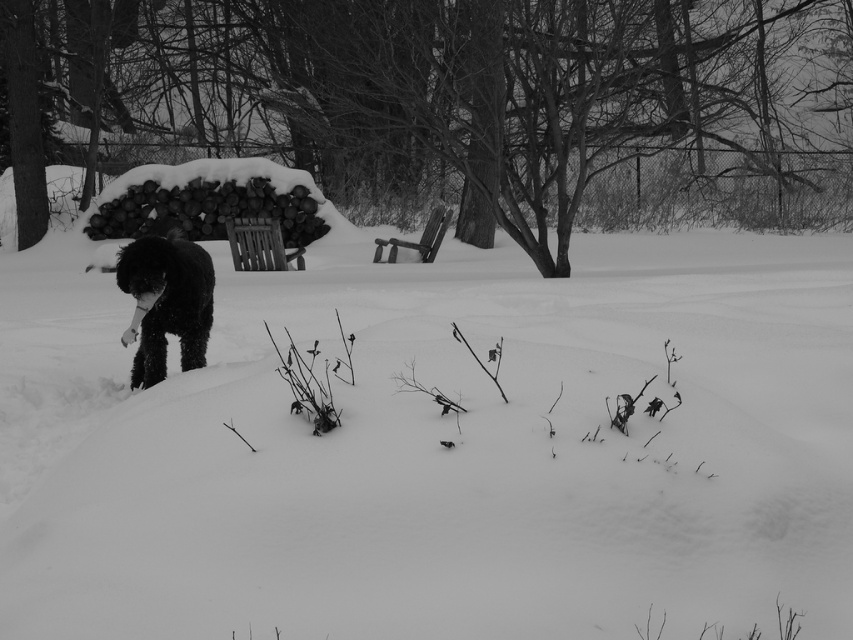
Question: Can you confirm if white fluffy snow at center is positioned to the left of black fluffy dog at left?

Choices:
 (A) no
 (B) yes

Answer: (A)

Question: Which point appears farthest from the camera in this image?

Choices:
 (A) (177, 314)
 (B) (485, 256)

Answer: (B)

Question: Which of the following is the farthest from the observer?

Choices:
 (A) (183, 244)
 (B) (759, 588)

Answer: (A)

Question: Observing the image, what is the correct spatial positioning of white fluffy snow at center in reference to black fluffy dog at left?

Choices:
 (A) right
 (B) left

Answer: (A)

Question: Can you confirm if white fluffy snow at center is wider than black fluffy dog at left?

Choices:
 (A) yes
 (B) no

Answer: (A)

Question: Which of the following is the closest to the observer?

Choices:
 (A) white fluffy snow at center
 (B) black fluffy dog at left

Answer: (A)